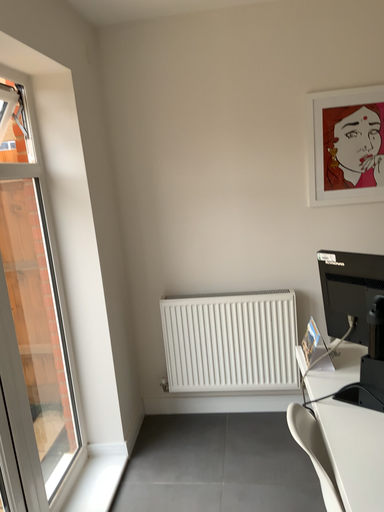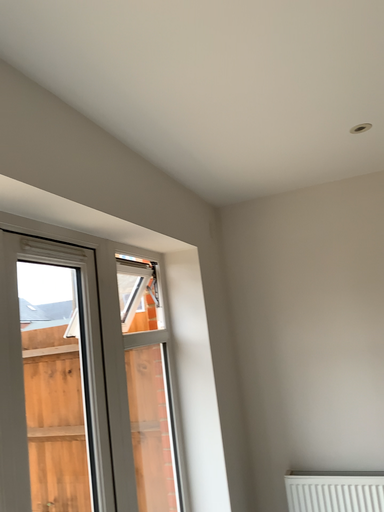
Question: How did the camera likely rotate when shooting the video?

Choices:
 (A) rotated left
 (B) rotated right

Answer: (A)